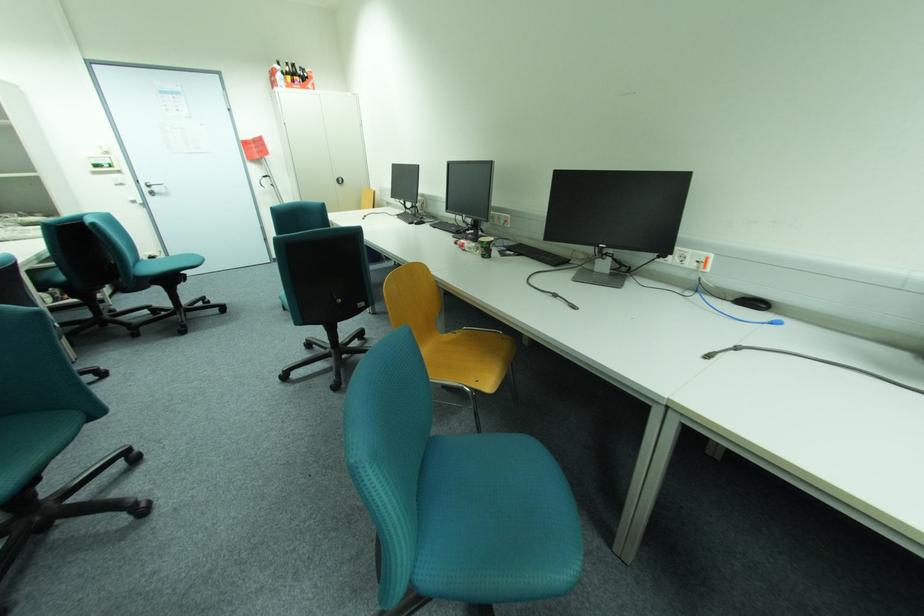
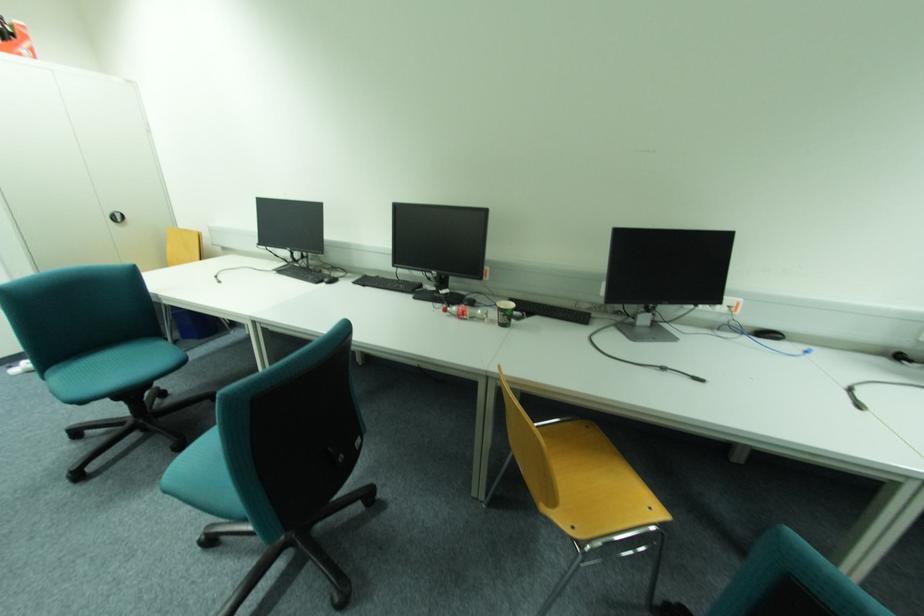
Where in the second image is the point corresponding to (463,243) from the first image?

(451, 310)